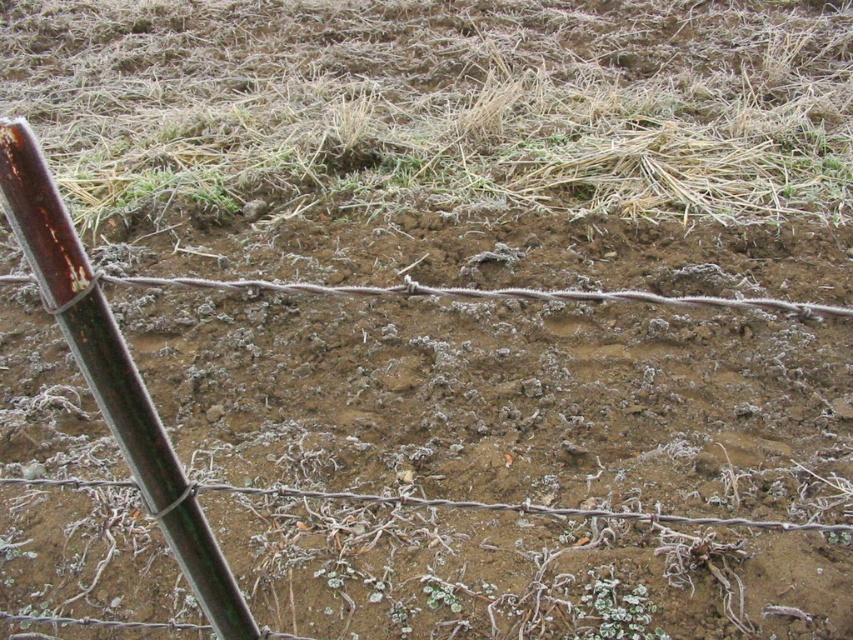
Question: Can you confirm if frosted dry grass at upper center is wider than rusty metal pole at left?

Choices:
 (A) yes
 (B) no

Answer: (A)

Question: Which object is closer to the camera taking this photo?

Choices:
 (A) frosted dry grass at upper center
 (B) rusty metal pole at left

Answer: (B)

Question: Which object appears closest to the camera in this image?

Choices:
 (A) frosted dry grass at upper center
 (B) rusty metal pole at left

Answer: (B)

Question: Does frosted dry grass at upper center appear under rusty metal pole at left?

Choices:
 (A) yes
 (B) no

Answer: (B)

Question: Does frosted dry grass at upper center have a greater width compared to rusty metal pole at left?

Choices:
 (A) no
 (B) yes

Answer: (B)